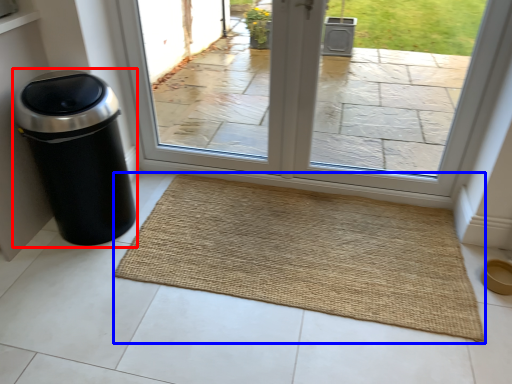
Question: Which of the following is the closest to the observer, waste container (highlighted by a red box) or mat (highlighted by a blue box)?

Choices:
 (A) waste container
 (B) mat

Answer: (A)